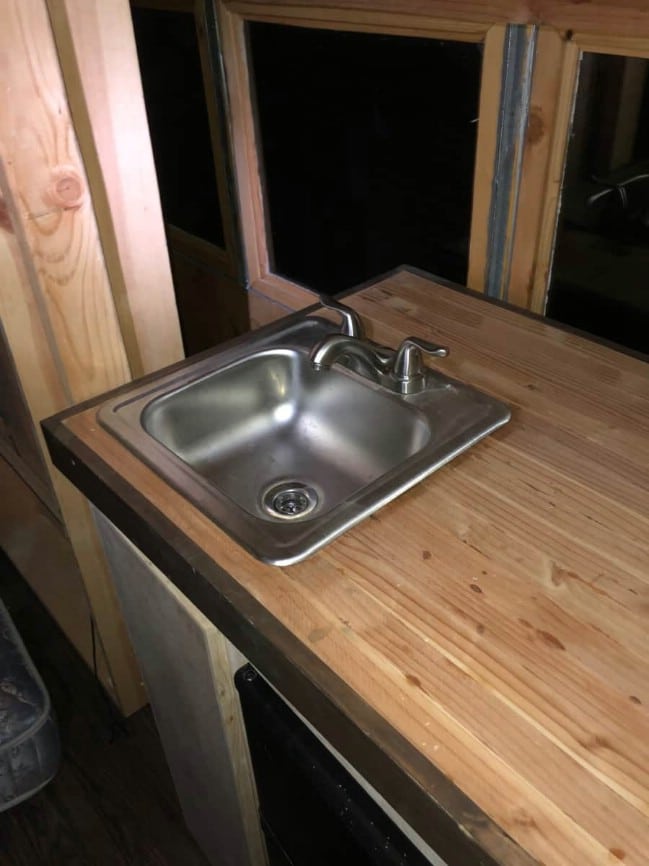
Find the location of a particular element. This screenshot has width=649, height=866. faucet is located at coordinates (344, 351).